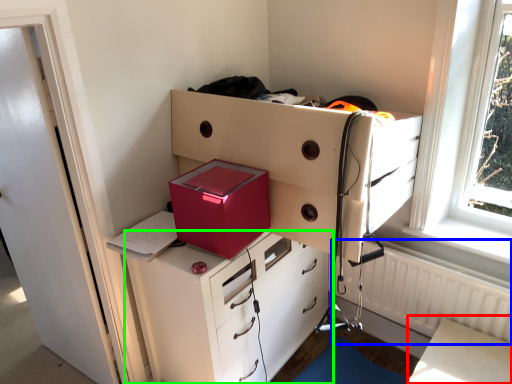
Question: Estimate the real-world distances between objects in this image. Which object is closer to table (highlighted by a red box), radiator (highlighted by a blue box) or chest of drawers (highlighted by a green box)?

Choices:
 (A) radiator
 (B) chest of drawers

Answer: (A)